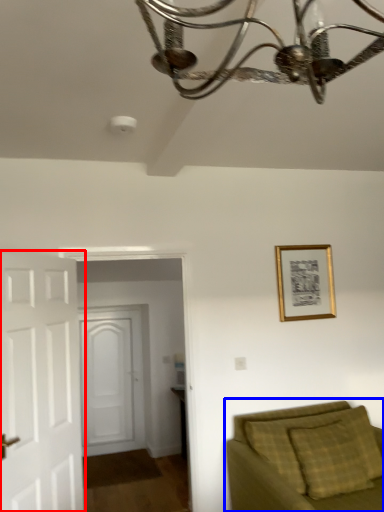
Question: Which point is closer to the camera, door (highlighted by a red box) or studio couch (highlighted by a blue box)?

Choices:
 (A) door
 (B) studio couch

Answer: (B)